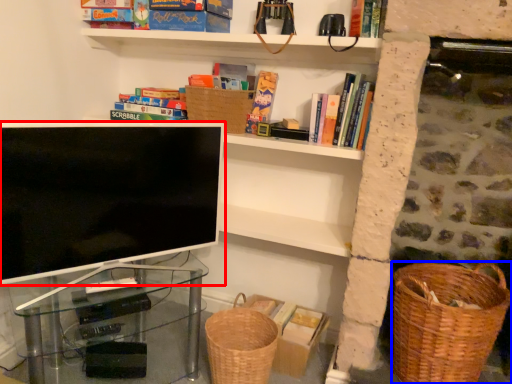
Question: Which object appears farthest to the camera in this image, television (highlighted by a red box) or basket container (highlighted by a blue box)?

Choices:
 (A) television
 (B) basket container

Answer: (B)